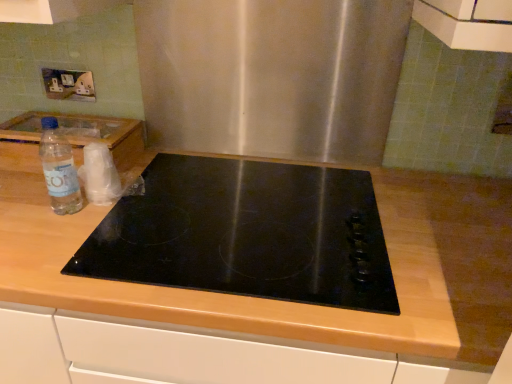
Question: From the image's perspective, is clear plastic bottle at left above or below white plastic electric outlet at upper left?

Choices:
 (A) below
 (B) above

Answer: (A)

Question: In terms of width, does clear plastic bottle at left look wider or thinner when compared to white plastic electric outlet at upper left?

Choices:
 (A) thin
 (B) wide

Answer: (B)

Question: Which object is positioned farthest from the wooden at center?

Choices:
 (A) clear plastic bottle at left
 (B) white plastic electric outlet at upper left
 (C) black glass cooktop at center

Answer: (B)

Question: Considering the real-world distances, which object is closest to the white plastic electric outlet at upper left?

Choices:
 (A) clear plastic bottle at left
 (B) black glass cooktop at center
 (C) wooden at center

Answer: (A)